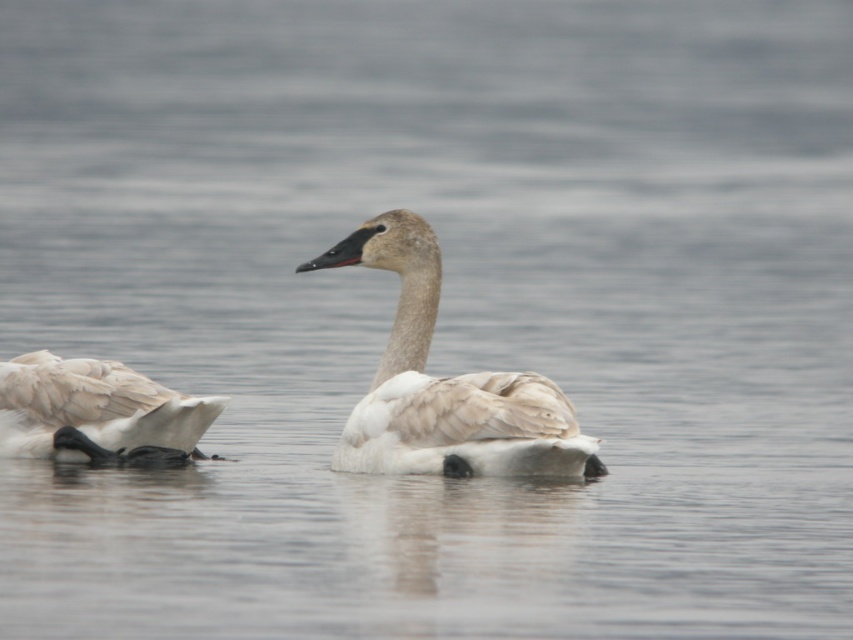
You are a photographer trying to capture the white feathered swan at center. You notice a point marked at coordinates (445,385). Where is this point located in relation to the swan?

The point at coordinates (445,385) is on the white feathered swan at center.

You are an ornithologist observing two birds in a lake. You see the white feathered swan at center and the white feathered duck at left. Which bird has a shorter height?

The white feathered swan at center is not as tall as the white feathered duck at left, so the swan is shorter in height.

You are a photographer trying to capture both the white feathered swan at center and the white feathered duck at left in a single shot. Based on their positions, which one would appear closer to the camera in the photo?

The white feathered swan at center appears closer to the camera because it is in front of the white feathered duck at left.